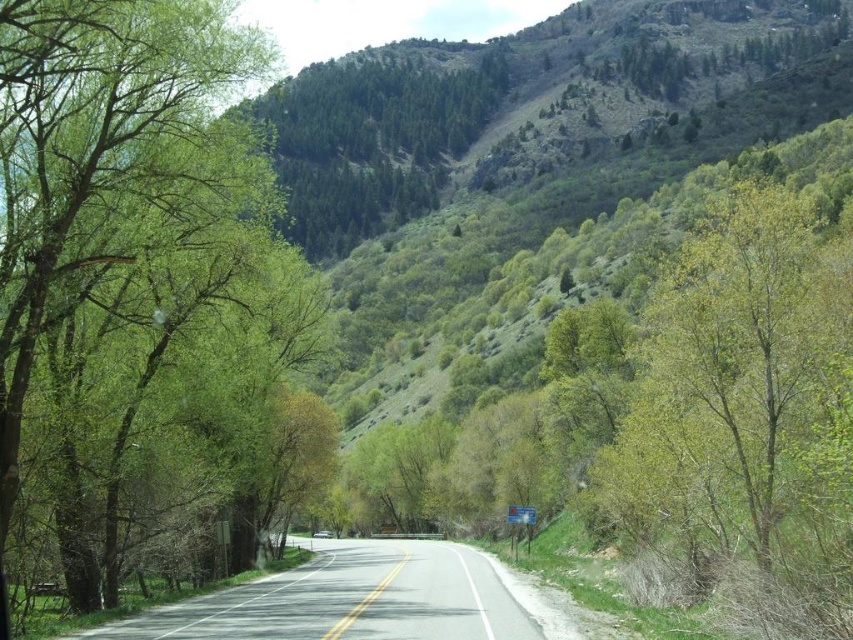
Question: Which point is farther to the camera?

Choices:
 (A) (407, 564)
 (B) (175, 113)

Answer: (A)

Question: Is green leafy tree at left further to the viewer compared to gray asphalt road at center?

Choices:
 (A) no
 (B) yes

Answer: (B)

Question: Which object is closer to the camera taking this photo?

Choices:
 (A) green leafy tree at left
 (B) gray asphalt road at center

Answer: (B)

Question: Considering the relative positions of green leafy tree at left and gray asphalt road at center in the image provided, where is green leafy tree at left located with respect to gray asphalt road at center?

Choices:
 (A) above
 (B) below

Answer: (A)

Question: Does green leafy tree at left lie behind gray asphalt road at center?

Choices:
 (A) no
 (B) yes

Answer: (B)